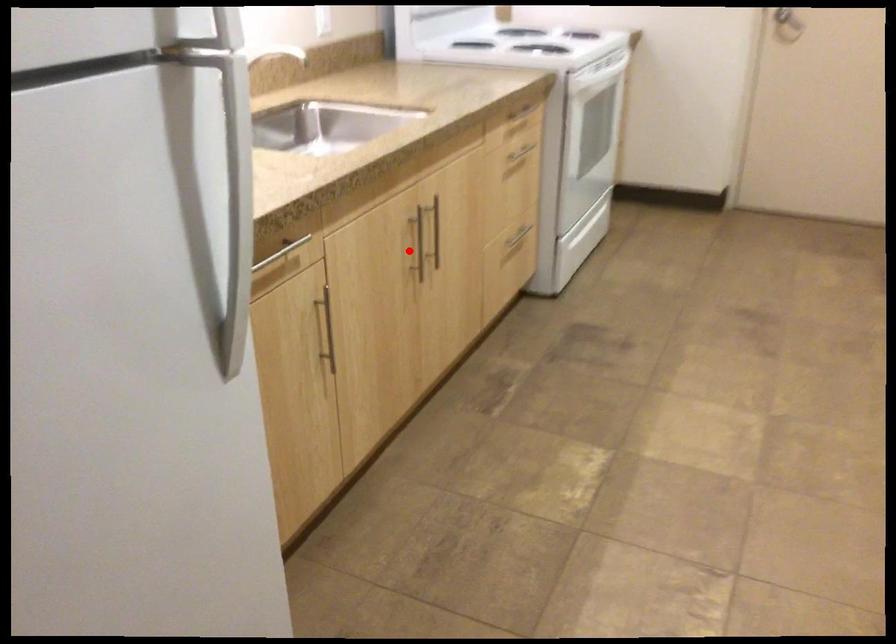
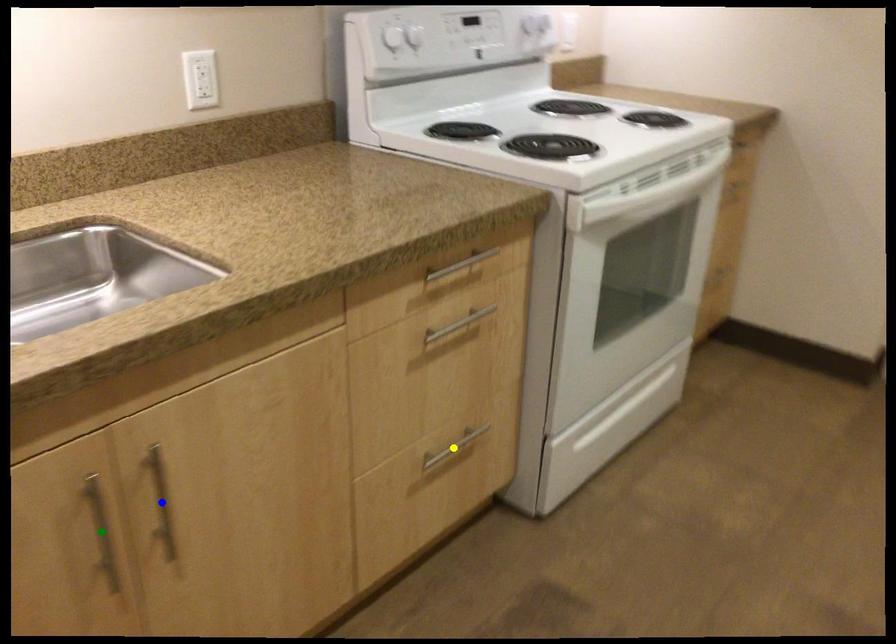
Question: I am providing you with two images of the same scene from different viewpoints. A red point is marked on the first image. You are given multiple points on the second image. Which point in image 2 represents the same 3d spot as the red point in image 1?

Choices:
 (A) green point
 (B) blue point
 (C) yellow point

Answer: (A)